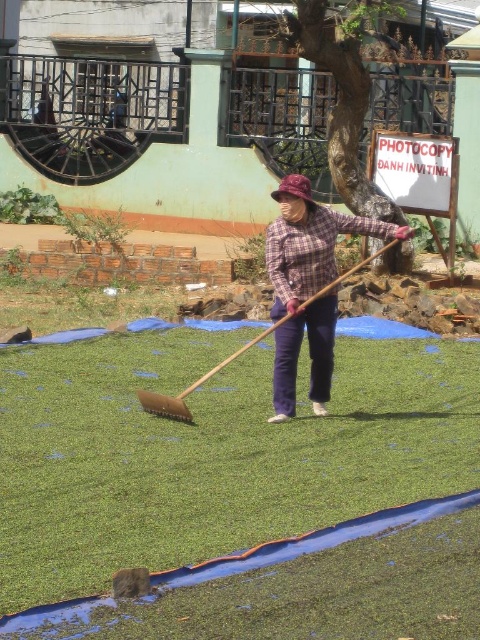
You are standing at the point labeled as point (240,490) in the image. What type of surface are you currently standing on?

The point (240,490) is on green leafy grass at center, so you are standing on green leafy grass.

You are standing at the center of the image and want to move towards the green leafy grass at center. Which direction should you go?

→ The green leafy grass at center is already at your current position since you are both at the center of the image.

You are a farmer standing in the field and you see the green leafy grass at center and the plaid fabric shirt at center. Which object is taller?

The plaid fabric shirt at center is taller than the green leafy grass at center.